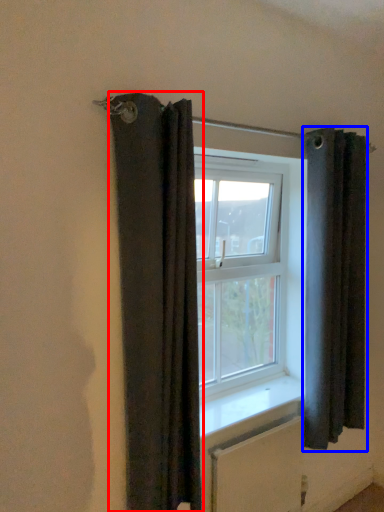
Question: Which point is closer to the camera, curtain (highlighted by a red box) or curtain (highlighted by a blue box)?

Choices:
 (A) curtain
 (B) curtain

Answer: (A)